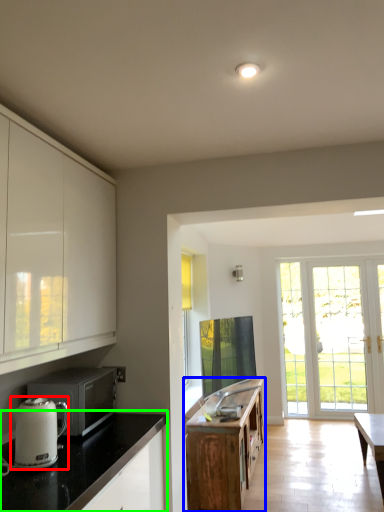
Question: Based on their relative distances, which object is nearer to kitchen appliance (highlighted by a red box)? Choose from cabinetry (highlighted by a blue box) and countertop (highlighted by a green box).

Choices:
 (A) cabinetry
 (B) countertop

Answer: (B)